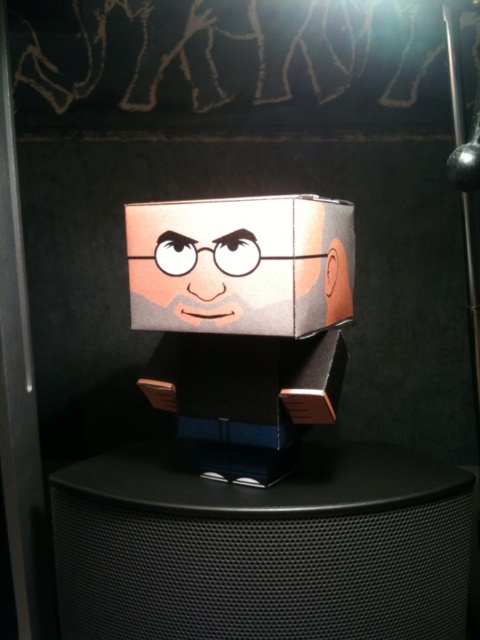
You are trying to hang a decorative item on the wall where the black mesh speaker at center and the matte paper face at center are displayed. If you want to place a new item between them, which object should you consider the width of to ensure the new item fits?

You should consider the width of the black mesh speaker at center because it is wider than the matte paper face at center, so ensuring the new item fits within its width would be necessary.

You are an artist trying to hang a small decorative item between the black mesh speaker at center and the matte paper face at center. The item requires 12 inches of space. Can you fit it there?

The distance between the black mesh speaker at center and the matte paper face at center is 14.89 inches, so yes, the 12 inches required for the decorative item will fit between them.

From the picture: You are setting up a small desk in your room and want to place both the black mesh speaker at center and the matte cardboard box at center on the desk. The desk has a width of 30 cm. The speaker requires a minimum of 25 cm of space to function properly. Can both items fit side by side on the desk without exceeding its width?

The black mesh speaker at center is wider than the matte cardboard box at center. Since the speaker needs at least 25 cm of space and the desk is only 30 cm wide, there is only 5 cm remaining for the box. However, without knowing the exact width of the box, we cannot confirm if both will fit. Please measure the box to ensure the total width does not exceed 30 cm.